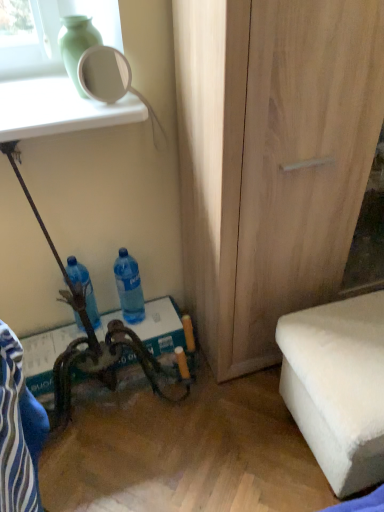
Question: From a real-world perspective, does white fluffy ottoman at lower right stand above blue fabric swivel chair at lower left?

Choices:
 (A) yes
 (B) no

Answer: (B)

Question: Is white fluffy ottoman at lower right to the left of blue fabric swivel chair at lower left from the viewer's perspective?

Choices:
 (A) yes
 (B) no

Answer: (B)

Question: Is white fluffy ottoman at lower right turned away from blue fabric swivel chair at lower left?

Choices:
 (A) no
 (B) yes

Answer: (A)

Question: Does white fluffy ottoman at lower right have a larger size compared to blue fabric swivel chair at lower left?

Choices:
 (A) no
 (B) yes

Answer: (B)

Question: Can you confirm if white fluffy ottoman at lower right is taller than blue fabric swivel chair at lower left?

Choices:
 (A) yes
 (B) no

Answer: (B)

Question: Considering the relative sizes of white fluffy ottoman at lower right and blue fabric swivel chair at lower left in the image provided, is white fluffy ottoman at lower right smaller than blue fabric swivel chair at lower left?

Choices:
 (A) yes
 (B) no

Answer: (B)

Question: Considering the relative positions of blue fabric swivel chair at lower left and blue translucent bottle at lower center, which is the 1th bottle from right to left, in the image provided, is blue fabric swivel chair at lower left in front of blue translucent bottle at lower center, which is the 1th bottle from right to left,?

Choices:
 (A) yes
 (B) no

Answer: (A)

Question: Is blue fabric swivel chair at lower left thinner than blue translucent bottle at lower center, placed as the 2th bottle when sorted from left to right?

Choices:
 (A) no
 (B) yes

Answer: (A)

Question: From the image's perspective, is blue fabric swivel chair at lower left over blue translucent bottle at lower center, which is the 1th bottle from right to left?

Choices:
 (A) no
 (B) yes

Answer: (A)

Question: Is blue translucent bottle at lower center, placed as the 2th bottle when sorted from left to right, completely or partially inside blue fabric swivel chair at lower left?

Choices:
 (A) yes
 (B) no

Answer: (B)

Question: Is blue fabric swivel chair at lower left turned away from blue translucent bottle at lower center, placed as the 2th bottle when sorted from left to right?

Choices:
 (A) yes
 (B) no

Answer: (B)

Question: Is blue fabric swivel chair at lower left at the right side of blue translucent bottle at lower center, which is the 1th bottle from right to left?

Choices:
 (A) yes
 (B) no

Answer: (B)

Question: Does blue translucent bottle at lower center, which is the 1th bottle from right to left, have a lesser height compared to white fluffy ottoman at lower right?

Choices:
 (A) yes
 (B) no

Answer: (A)